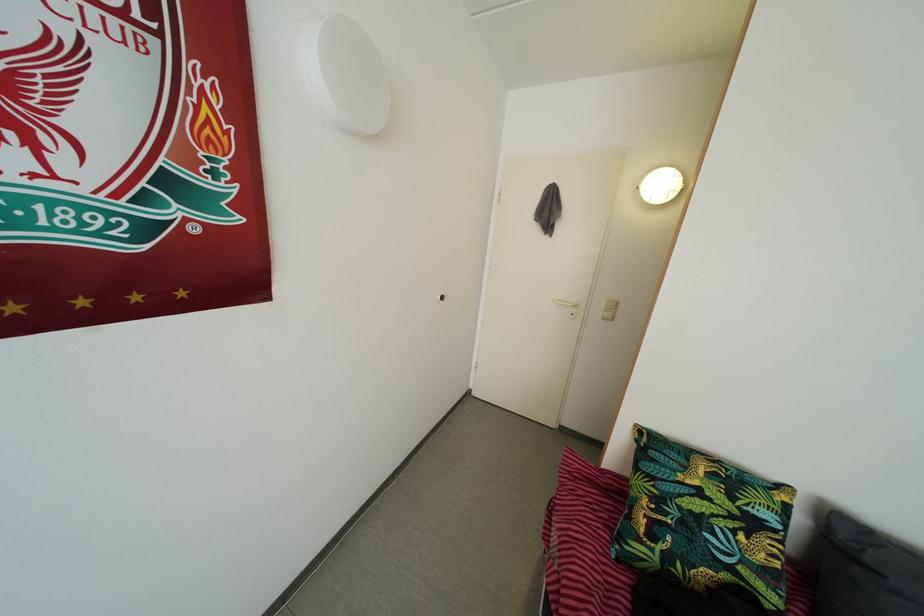
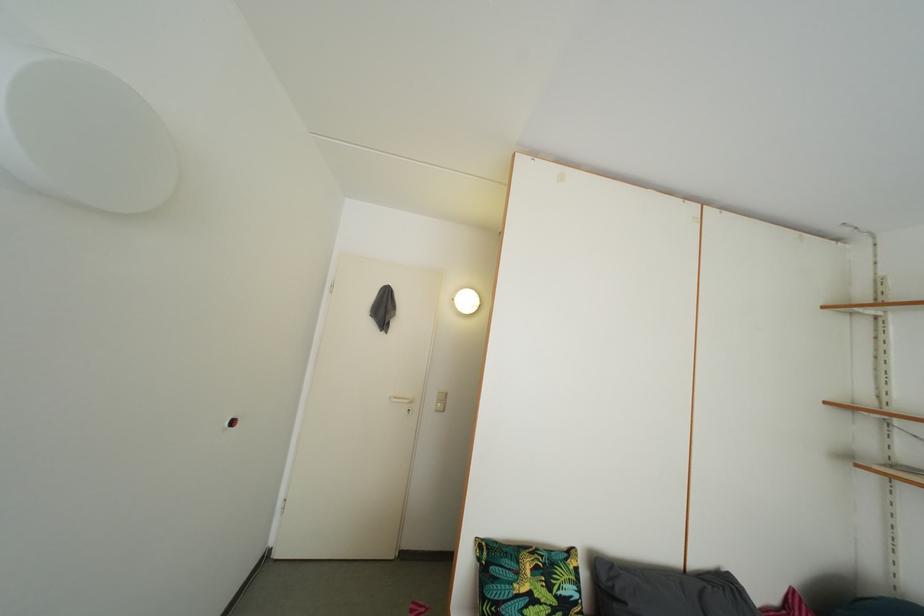
Locate, in the second image, the point that corresponds to point 604,318 in the first image.

(439, 411)